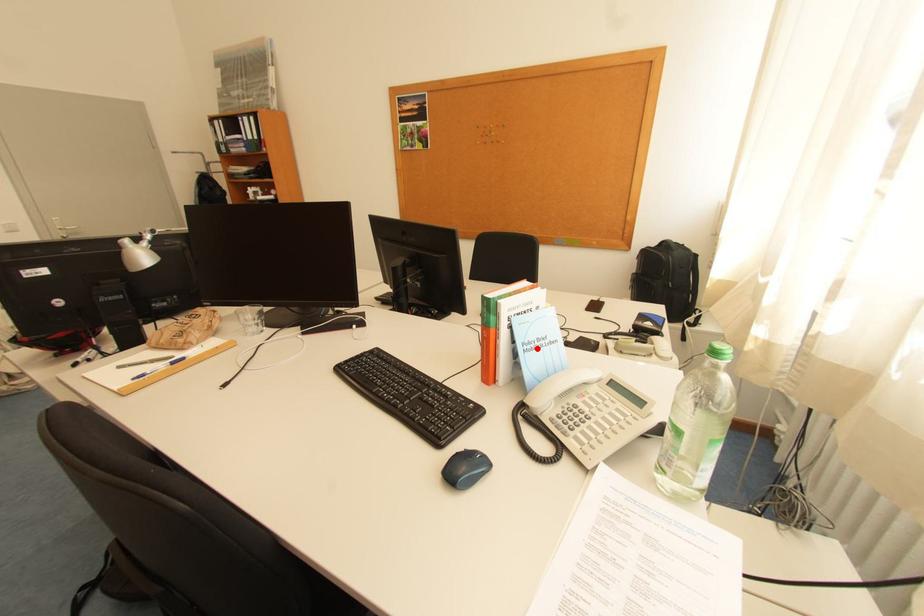
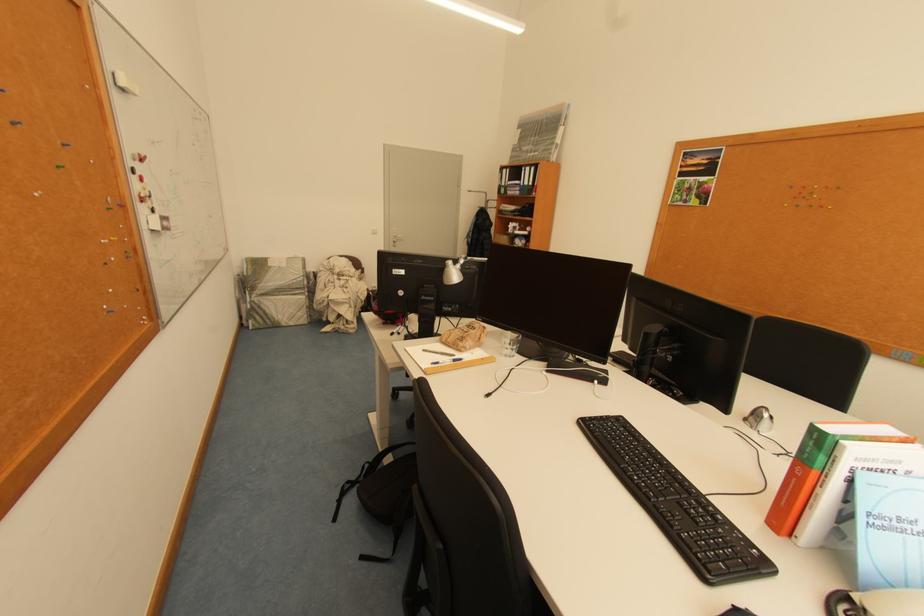
In the second image, find the point that corresponds to the highlighted location in the first image.

(886, 524)